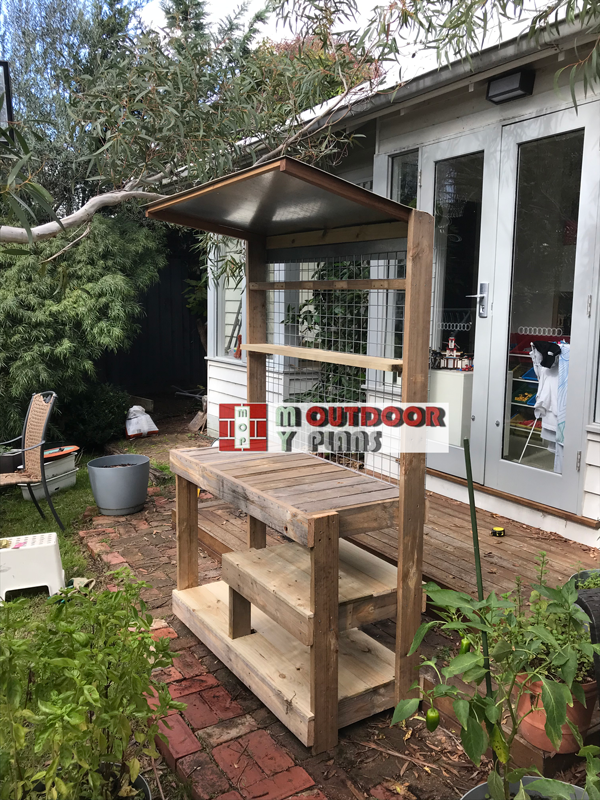
This screenshot has width=600, height=800. I want to click on pot, so click(533, 717).